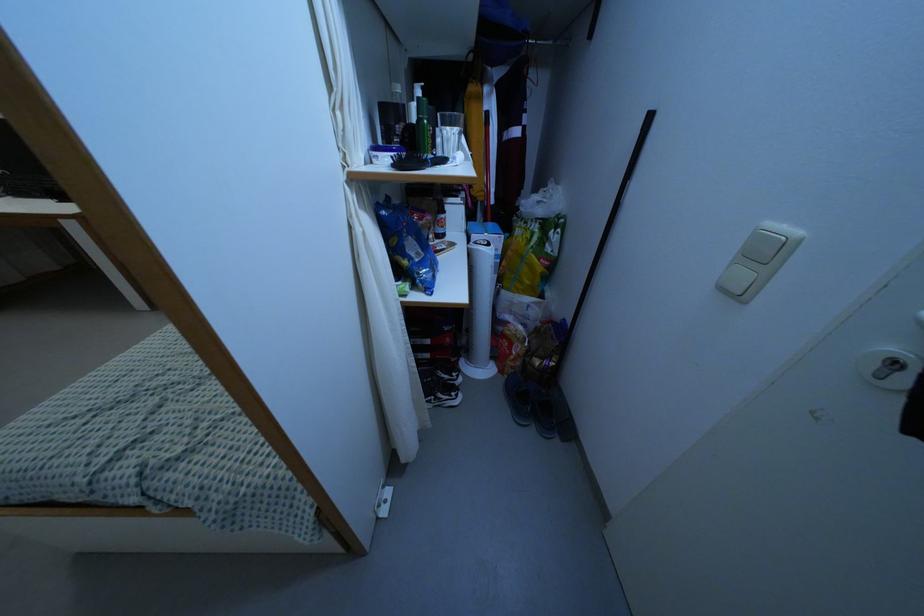
Find the location of `green bottle pump`. green bottle pump is located at coordinates (422, 127).